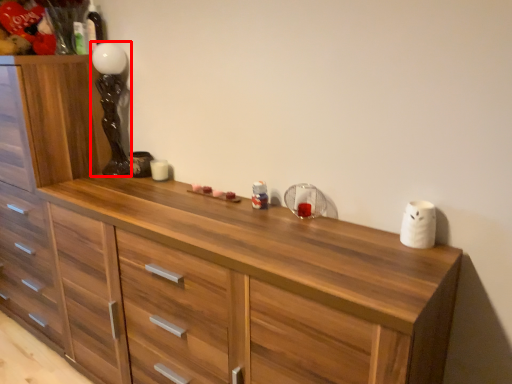
Question: Where is lamp (annotated by the red box) located in relation to chest of drawers in the image?

Choices:
 (A) left
 (B) right

Answer: (B)